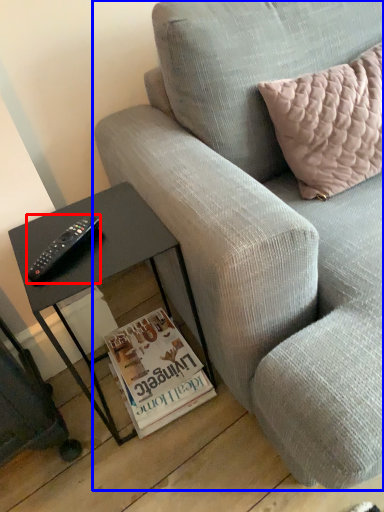
Question: Which object is further to the camera taking this photo, remote (highlighted by a red box) or studio couch (highlighted by a blue box)?

Choices:
 (A) remote
 (B) studio couch

Answer: (A)